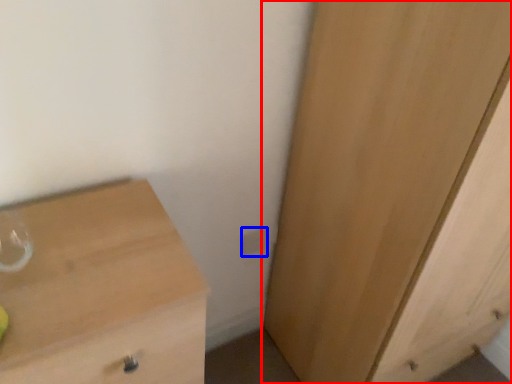
Question: Among these objects, which one is farthest to the camera, cupboard (highlighted by a red box) or electric outlet (highlighted by a blue box)?

Choices:
 (A) cupboard
 (B) electric outlet

Answer: (B)